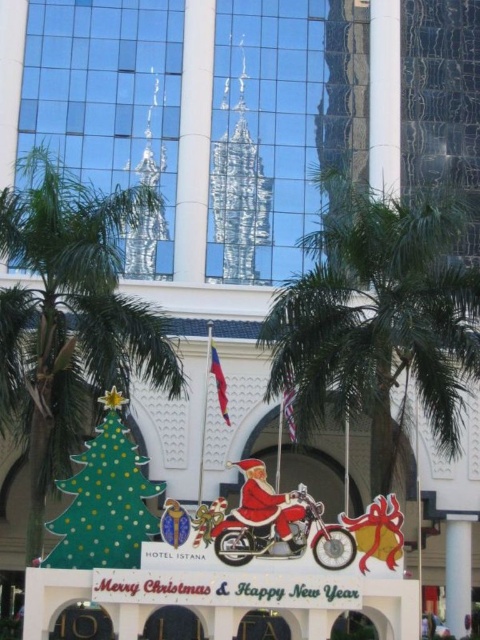
Question: Which point is farther to the camera?

Choices:
 (A) (216, 552)
 (B) (84, 467)
 (C) (34, 400)

Answer: (C)

Question: From the image, what is the correct spatial relationship of green leafy palm tree at center in relation to shiny chrome motorcycle at center?

Choices:
 (A) left
 (B) right

Answer: (B)

Question: Among these points, which one is nearest to the camera?

Choices:
 (A) (335, 401)
 (B) (83, 205)

Answer: (B)

Question: Based on their relative distances, which object is farther from the matte red santa at center?

Choices:
 (A) shiny chrome motorcycle at center
 (B) green leafy palm tree at left
 (C) green polka dot cardboard christmas tree at lower left
 (D) green leafy palm tree at center

Answer: (D)

Question: Is green leafy palm tree at center thinner than green leafy palm tree at left?

Choices:
 (A) yes
 (B) no

Answer: (B)

Question: Can you confirm if green leafy palm tree at left is smaller than matte red santa at center?

Choices:
 (A) yes
 (B) no

Answer: (B)